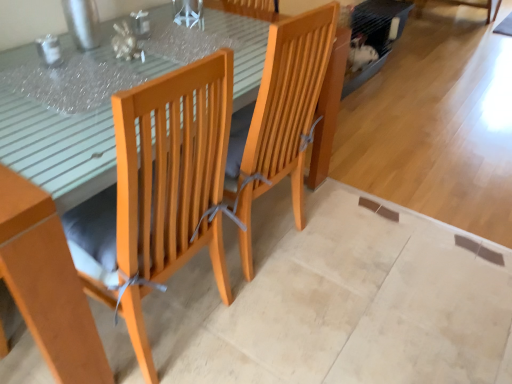
Where is `free spot above wooden table at center (from a real-world perspective)`? free spot above wooden table at center (from a real-world perspective) is located at coordinates (134, 63).